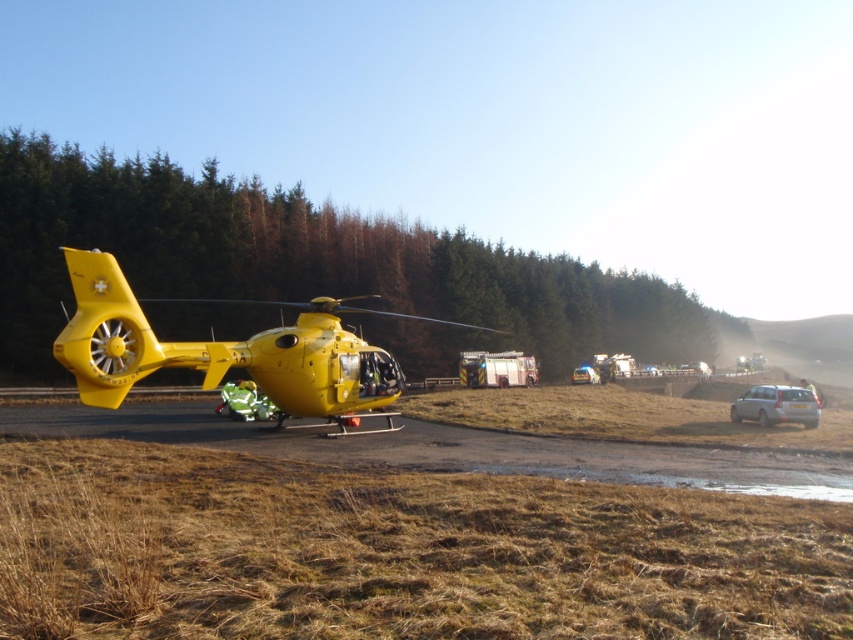
Question: Can you confirm if brown dirt track at lower center is positioned above white glossy car at center?

Choices:
 (A) yes
 (B) no

Answer: (A)

Question: Is brown dirt track at lower center to the right of white glossy car at center from the viewer's perspective?

Choices:
 (A) yes
 (B) no

Answer: (B)

Question: Which object appears farthest from the camera in this image?

Choices:
 (A) white glossy car at center
 (B) yellow matte helicopter at left
 (C) silver metallic suv at right
 (D) brown dirt track at lower center

Answer: (A)

Question: Which of the following is the farthest from the observer?

Choices:
 (A) yellow matte helicopter at left
 (B) brown dirt track at lower center
 (C) white glossy car at center

Answer: (C)

Question: Is silver metallic suv at right wider than white glossy car at center?

Choices:
 (A) no
 (B) yes

Answer: (A)

Question: Among these points, which one is farthest from the camera?

Choices:
 (A) pyautogui.click(x=534, y=444)
 (B) pyautogui.click(x=573, y=384)
 (C) pyautogui.click(x=799, y=419)

Answer: (B)